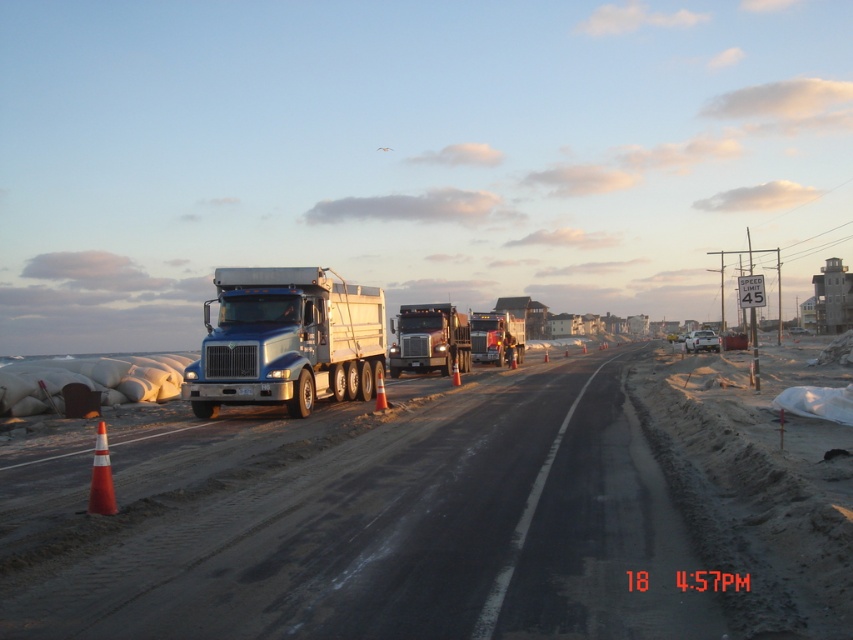
You are a delivery driver approaching the construction zone on the coastal road. Your truck has a length of 25 meters. You see the metallic silver trailer truck at center ahead of you. Can your truck safely pass through the construction zone without hitting any obstacles?

The metallic silver trailer truck at center is 26.81 meters from the camera. Since your truck is 25 meters long, it can safely pass through the construction zone as there is enough space between the truck and the obstacles.

You are a delivery driver approaching the two trailer trucks at center. The blue metallic trailer truck at center and the metallic silver trailer truck at center are both parked on the road. Which truck is closer to the left edge of the road?

The blue metallic trailer truck at center is positioned on the left side of the metallic silver trailer truck at center, so it is closer to the left edge of the road.

You are driving a delivery van and need to pass through the area where the metallic silver trailer truck at center and the metallic silver truck at center are located. Based on the scene, can you safely navigate around them without causing an obstruction?

The metallic silver trailer truck at center is positioned over the metallic silver truck at center, meaning it is likely blocking the path. You should wait until the trucks move or find an alternative route to avoid blocking traffic.